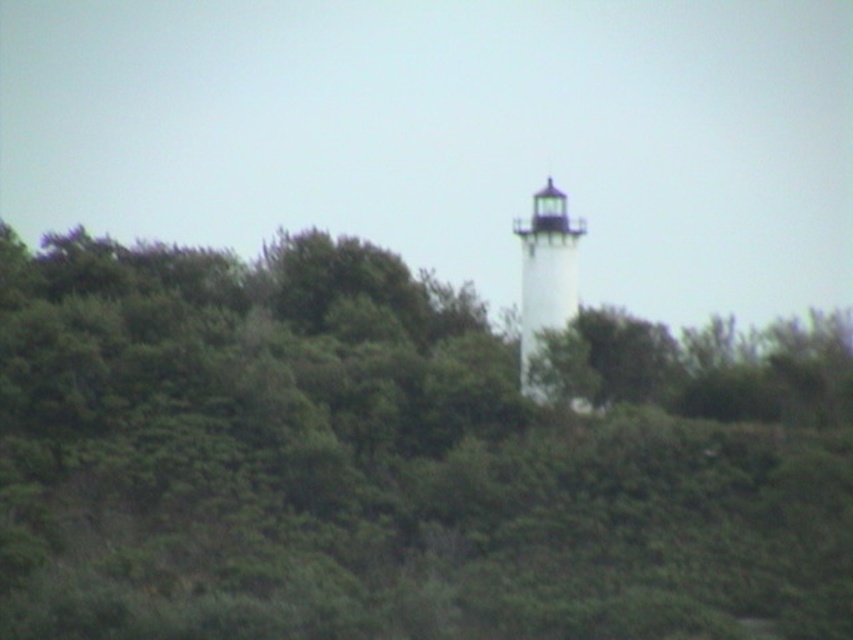
Can you confirm if green leafy tree at center is shorter than white painted wood lighthouse at center?

No, green leafy tree at center is not shorter than white painted wood lighthouse at center.

Between green leafy tree at center and white painted wood lighthouse at center, which one has more height?

green leafy tree at center is taller.

Is point (526, 445) positioned behind point (544, 253)?

No.

Identify the location of green leafy tree at center. (399, 458).